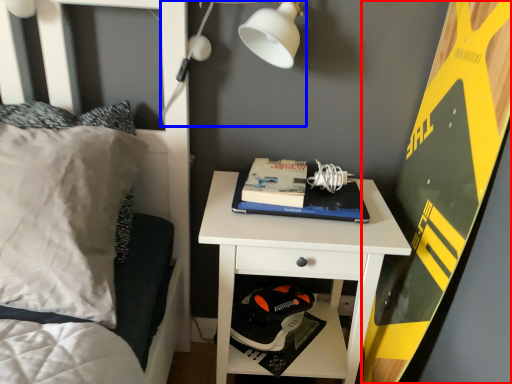
Question: Which object is closer to the camera taking this photo, bulletin board (highlighted by a red box) or light fixture (highlighted by a blue box)?

Choices:
 (A) bulletin board
 (B) light fixture

Answer: (A)